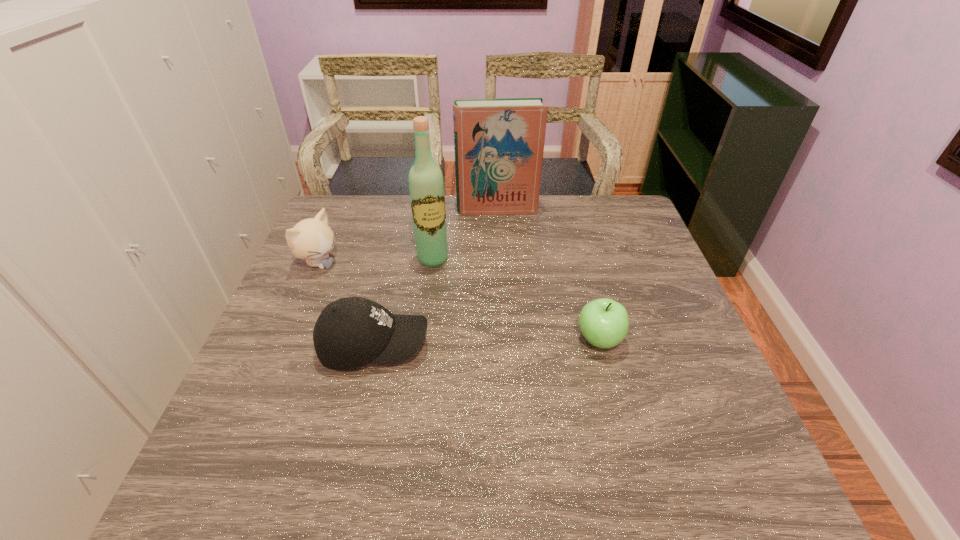
Image resolution: width=960 pixels, height=540 pixels. Identify the location of free location located 0.140m on the front-facing side of the wine bottle. (445, 302).

Where is `vacant space located 0.110m on the front-facing side of the wine bottle`? The image size is (960, 540). vacant space located 0.110m on the front-facing side of the wine bottle is located at coordinates point(444,294).

You are a GUI agent. You are given a task and a screenshot of the screen. Output one action in this format:
    pyautogui.click(x=<x>, y=<y>)
    Task: Click on the vacant space situated on the cover of the farthest object
    This screenshot has height=540, width=960.
    Given the screenshot: What is the action you would take?
    pyautogui.click(x=504, y=252)

I want to click on free space located 0.160m on the cover of the farthest object, so click(x=503, y=245).

The width and height of the screenshot is (960, 540). Identify the location of vacant point located on the cover of the farthest object. (509, 286).

In order to click on free spot located 0.220m on the face of the leftmost object in this screenshot , I will do `click(392, 302)`.

Identify the location of vacant area situated 0.100m on the face of the leftmost object. (359, 285).

Where is `free spot located 0.380m on the face of the leftmost object`? This screenshot has height=540, width=960. free spot located 0.380m on the face of the leftmost object is located at coordinates (440, 328).

Where is `object that is positioned at the far edge`? object that is positioned at the far edge is located at coordinates (499, 143).

This screenshot has width=960, height=540. I want to click on baseball cap that is at the left edge, so click(x=350, y=332).